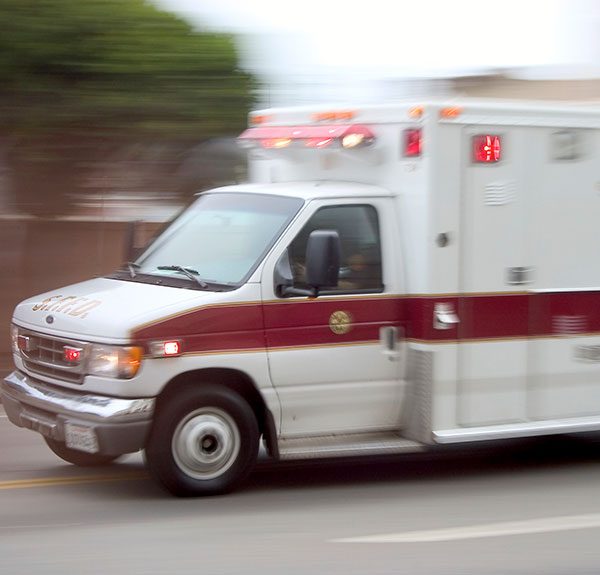
This screenshot has height=575, width=600. What are the coordinates of `left mirror` in the screenshot? It's located at (317, 266).